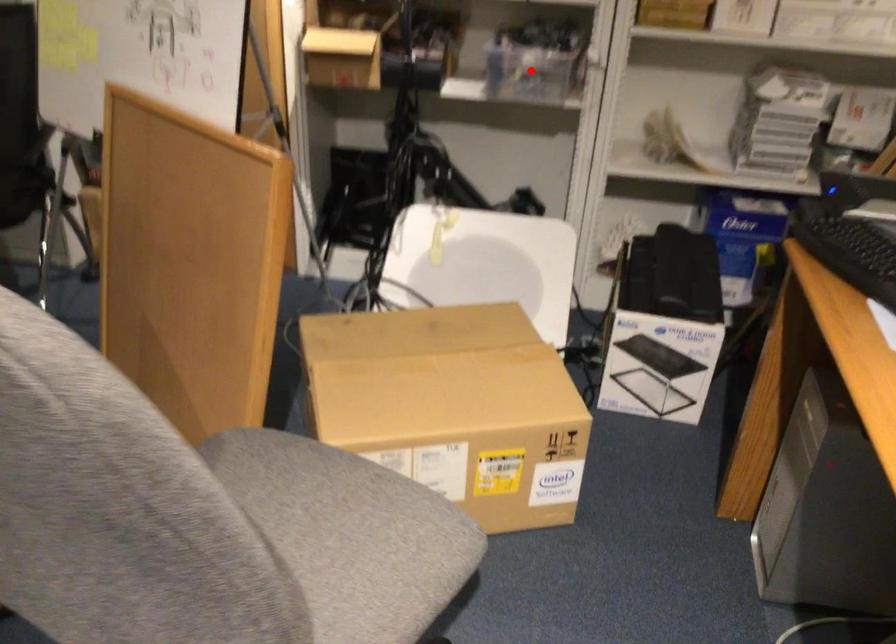
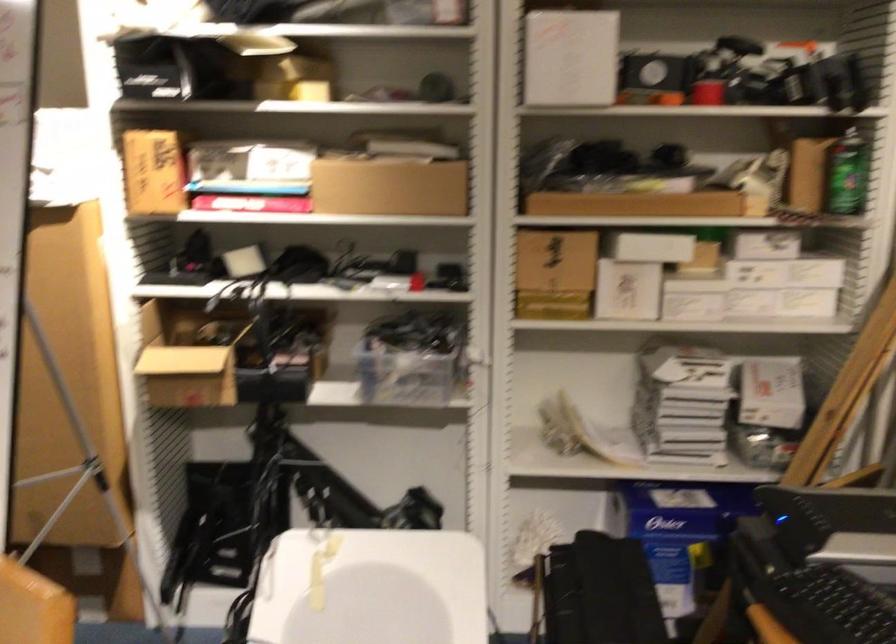
Locate, in the second image, the point that corresponds to the highlighted location in the first image.

(403, 375)